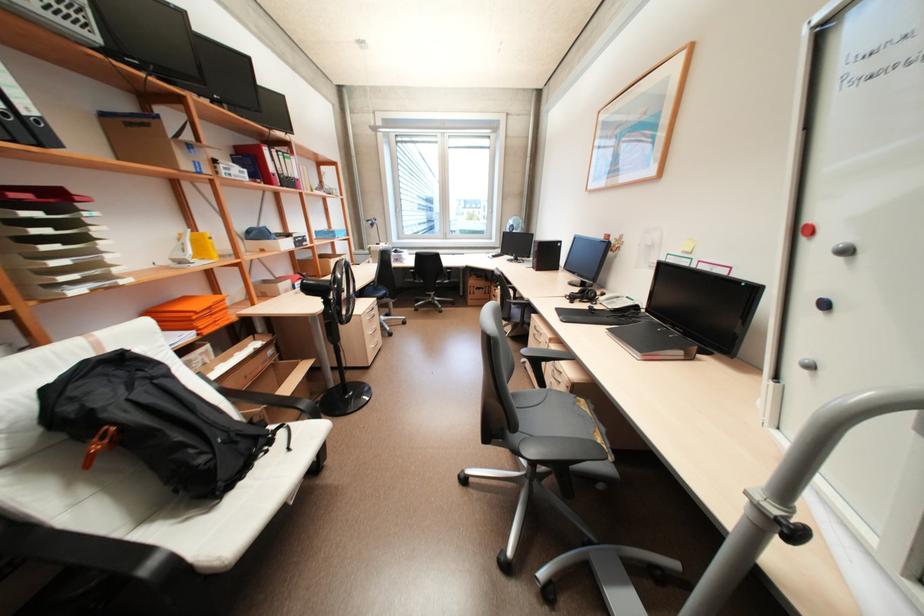
You are a GUI agent. You are given a task and a screenshot of the screen. Output one action in this format:
    pyautogui.click(x=<x>, y=<y>)
    Task: Click on the grey magnet
    The width and height of the screenshot is (924, 616).
    Given the screenshot: What is the action you would take?
    pyautogui.click(x=844, y=251)